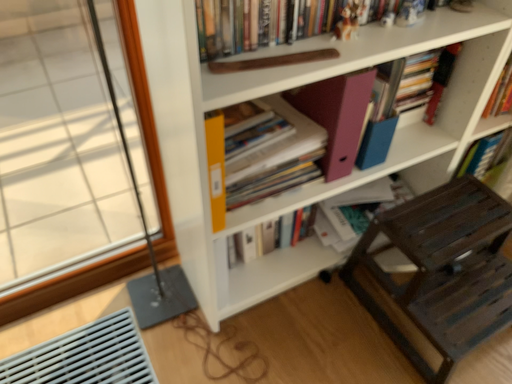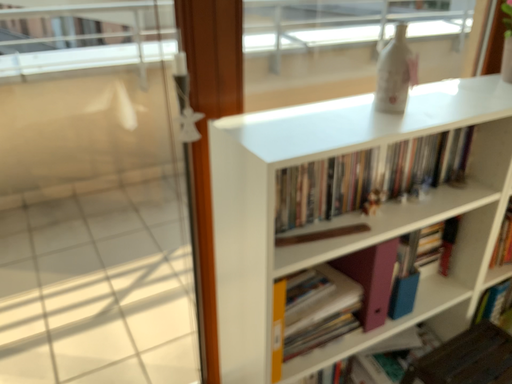
Question: Which way did the camera rotate in the video?

Choices:
 (A) rotated downward
 (B) rotated upward

Answer: (B)